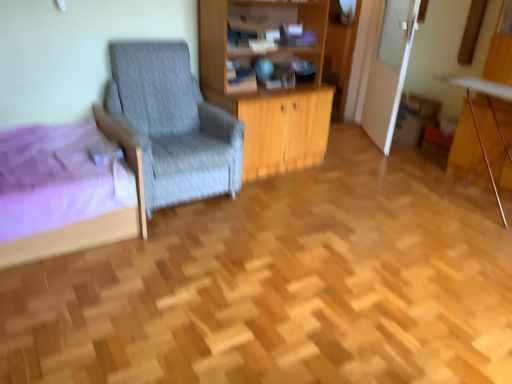
Question: Does wooden cabinet at center have a greater height compared to wooden desk at right?

Choices:
 (A) no
 (B) yes

Answer: (B)

Question: Are wooden cabinet at center and wooden desk at right beside each other?

Choices:
 (A) no
 (B) yes

Answer: (A)

Question: Is wooden cabinet at center shorter than wooden desk at right?

Choices:
 (A) no
 (B) yes

Answer: (A)

Question: Does wooden cabinet at center have a larger size compared to wooden desk at right?

Choices:
 (A) yes
 (B) no

Answer: (A)

Question: Is wooden cabinet at center not close to wooden desk at right?

Choices:
 (A) yes
 (B) no

Answer: (A)

Question: From the image's perspective, is wooden desk at right positioned above or below purple fabric bed at lower left?

Choices:
 (A) above
 (B) below

Answer: (A)

Question: Considering the positions of point pyautogui.click(x=477, y=132) and point pyautogui.click(x=114, y=240), is point pyautogui.click(x=477, y=132) closer or farther from the camera than point pyautogui.click(x=114, y=240)?

Choices:
 (A) closer
 (B) farther

Answer: (B)

Question: Looking at their shapes, would you say wooden desk at right is wider or thinner than purple fabric bed at lower left?

Choices:
 (A) wide
 (B) thin

Answer: (B)

Question: Is wooden desk at right taller or shorter than purple fabric bed at lower left?

Choices:
 (A) short
 (B) tall

Answer: (B)

Question: Is wooden desk at right inside the boundaries of wooden cabinet at center, or outside?

Choices:
 (A) inside
 (B) outside

Answer: (B)

Question: Is wooden desk at right wider or thinner than wooden cabinet at center?

Choices:
 (A) thin
 (B) wide

Answer: (A)

Question: Is point (444, 77) positioned closer to the camera than point (231, 21)?

Choices:
 (A) closer
 (B) farther

Answer: (B)

Question: Is wooden desk at right bigger or smaller than wooden cabinet at center?

Choices:
 (A) big
 (B) small

Answer: (B)

Question: Relative to wooden desk at right, is purple fabric bed at lower left in front or behind?

Choices:
 (A) front
 (B) behind

Answer: (A)

Question: Looking at their shapes, would you say purple fabric bed at lower left is wider or thinner than wooden desk at right?

Choices:
 (A) thin
 (B) wide

Answer: (B)